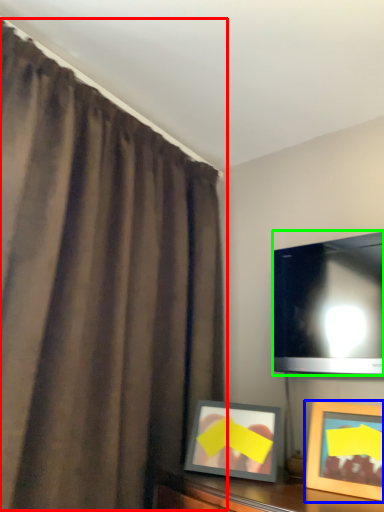
Question: Considering the real-world distances, which object is closest to curtain (highlighted by a red box)? picture frame (highlighted by a blue box) or television (highlighted by a green box).

Choices:
 (A) picture frame
 (B) television

Answer: (B)